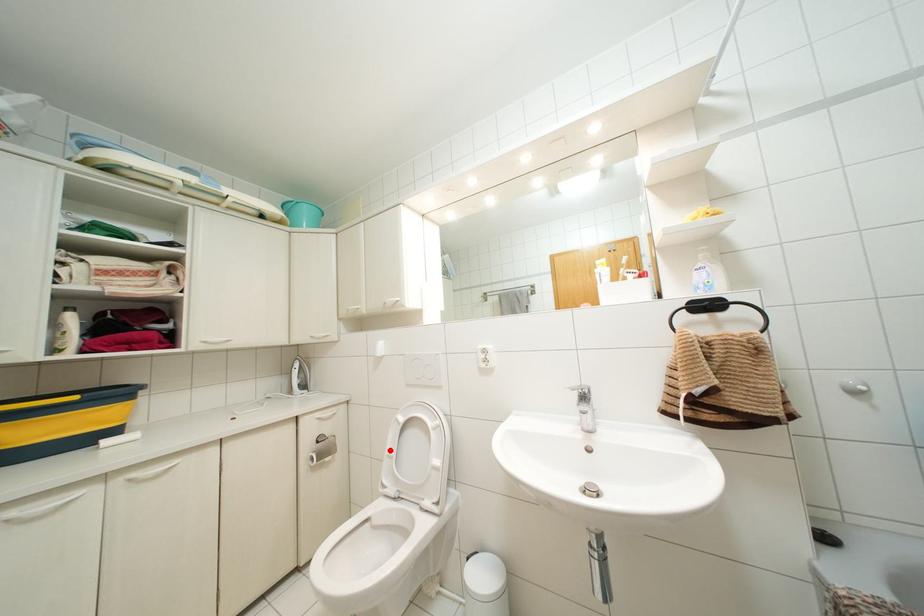
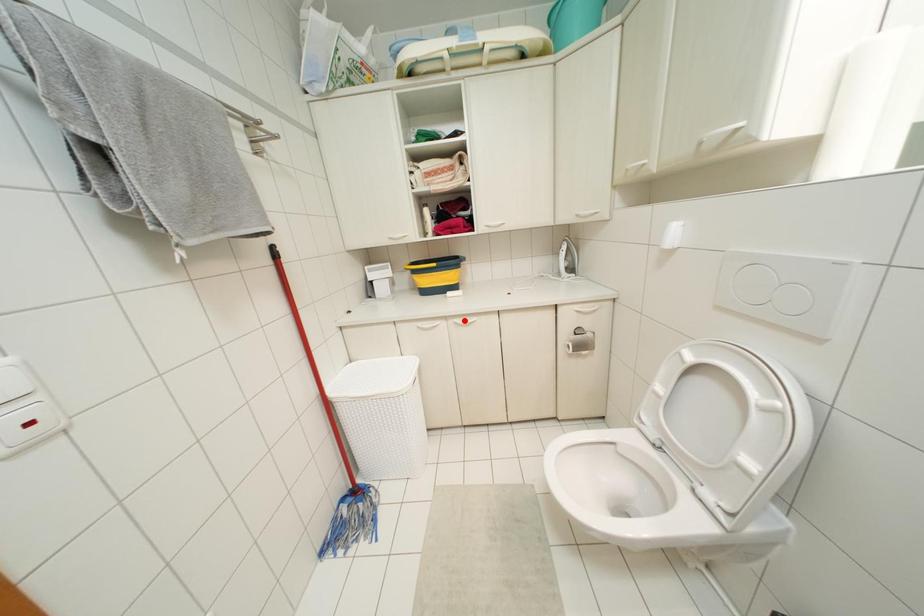
I am providing you with two images of the same scene from different viewpoints. A red point is marked on the first image and another point is marked on the second image. Does the point marked in image1 correspond to the same location as the one in image2?

No